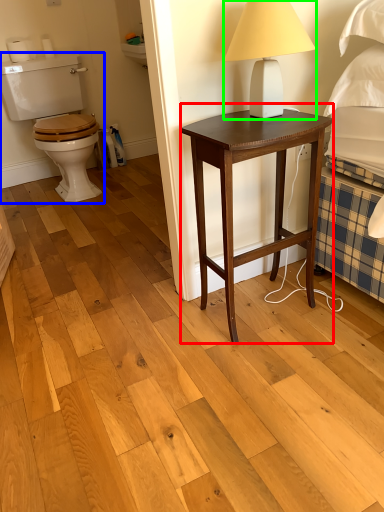
Question: Based on their relative distances, which object is nearer to nightstand (highlighted by a red box)? Choose from sit (highlighted by a blue box) and table lamp (highlighted by a green box).

Choices:
 (A) sit
 (B) table lamp

Answer: (B)